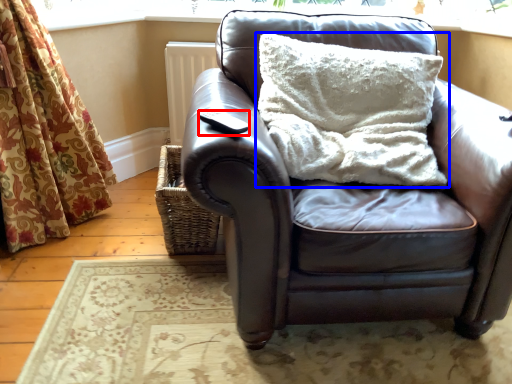
Question: Which of the following is the closest to the observer, pad (highlighted by a red box) or pillow (highlighted by a blue box)?

Choices:
 (A) pad
 (B) pillow

Answer: (A)